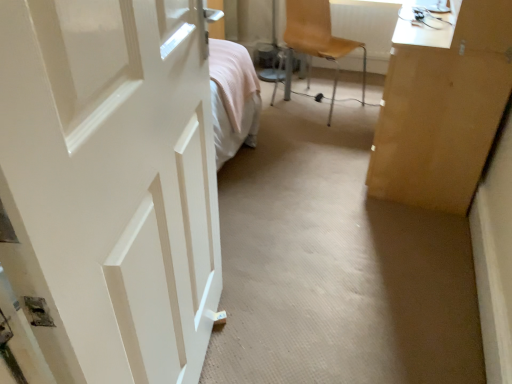
This screenshot has height=384, width=512. Describe the element at coordinates (315, 40) in the screenshot. I see `light brown wooden chair at center` at that location.

Locate an element on the screen. The image size is (512, 384). light brown wooden chair at center is located at coordinates (315, 40).

Measure the distance between point (271, 100) and camera.

Point (271, 100) and camera are 10.78 feet apart from each other.

Where is `light brown wooden chair at center`? light brown wooden chair at center is located at coordinates (315, 40).